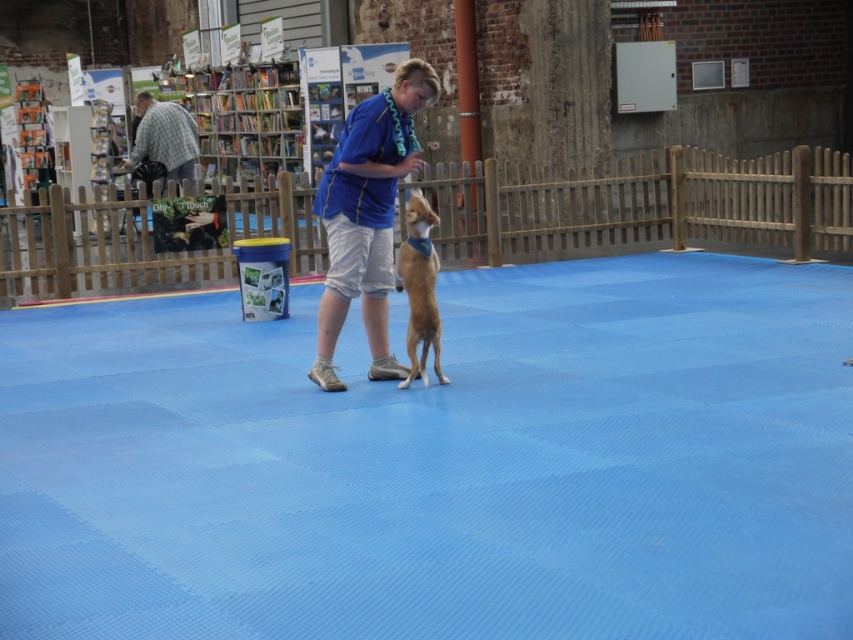
How much distance is there between brown fur dog at center and checkered fabric shirt at left?

A distance of 9.36 meters exists between brown fur dog at center and checkered fabric shirt at left.

What do you see at coordinates (419, 288) in the screenshot?
I see `brown fur dog at center` at bounding box center [419, 288].

Image resolution: width=853 pixels, height=640 pixels. In order to click on brown fur dog at center in this screenshot , I will do `click(419, 288)`.

Does blue fabric shirt at center have a lesser width compared to checkered fabric shirt at left?

Incorrect, blue fabric shirt at center's width is not less than checkered fabric shirt at left's.

Does blue fabric shirt at center have a larger size compared to checkered fabric shirt at left?

Yes.

Is point (341, 195) positioned before point (172, 138)?

Yes, it is in front of point (172, 138).

Locate an element on the screen. The image size is (853, 640). blue fabric shirt at center is located at coordinates [x=367, y=216].

Can you confirm if blue fabric shirt at center is positioned above brown fur dog at center?

Yes.

Is blue fabric shirt at center to the right of brown fur dog at center from the viewer's perspective?

No, blue fabric shirt at center is not to the right of brown fur dog at center.

Image resolution: width=853 pixels, height=640 pixels. Describe the element at coordinates (367, 216) in the screenshot. I see `blue fabric shirt at center` at that location.

Identify the location of blue fabric shirt at center. (367, 216).